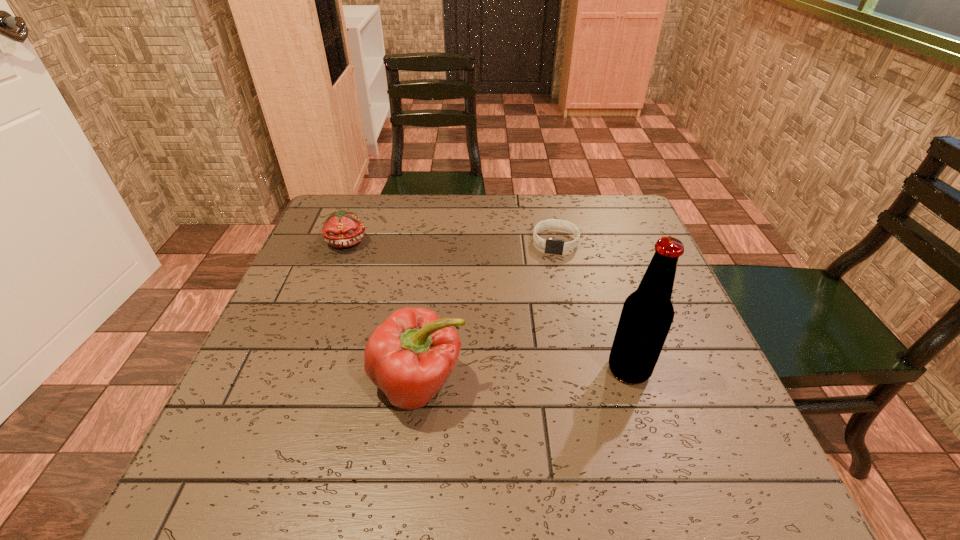
Locate an element on the screen. The width and height of the screenshot is (960, 540). bell pepper is located at coordinates (410, 356).

Where is `the third object from right to left`? The image size is (960, 540). the third object from right to left is located at coordinates (410, 356).

Locate an element on the screen. beer bottle is located at coordinates (647, 314).

You are a GUI agent. You are given a task and a screenshot of the screen. Output one action in this format:
    pyautogui.click(x=<x>, y=<y>)
    Task: Click on the third tallest object
    
    Given the screenshot: What is the action you would take?
    pyautogui.click(x=341, y=229)

I want to click on tomato, so click(x=341, y=229).

At what (x,y) coordinates should I click in order to perform the action: click on the shortest object. Please return your answer as a coordinate pair (x, y). Image resolution: width=960 pixels, height=540 pixels. Looking at the image, I should click on (551, 245).

This screenshot has width=960, height=540. I want to click on free space located on the right of the second tallest object, so click(568, 383).

At what (x,y) coordinates should I click in order to perform the action: click on free space located on the left of the beer bottle. Please return your answer as a coordinate pair (x, y). The height and width of the screenshot is (540, 960). Looking at the image, I should click on (489, 369).

Locate an element on the screen. The height and width of the screenshot is (540, 960). vacant region located on the front-facing side of the leftmost object is located at coordinates (431, 317).

Where is `vacant space located 0.070m on the front-facing side of the leftmost object`? The width and height of the screenshot is (960, 540). vacant space located 0.070m on the front-facing side of the leftmost object is located at coordinates (372, 265).